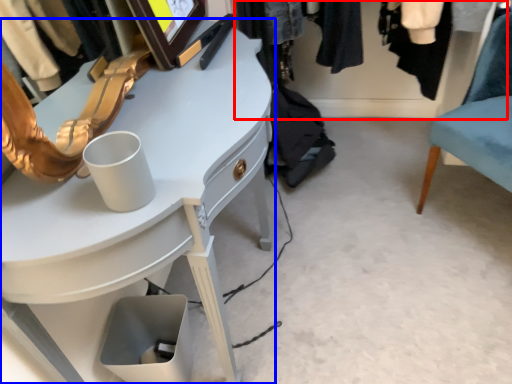
Question: Which point is closer to the camera, closet (highlighted by a red box) or desk (highlighted by a blue box)?

Choices:
 (A) closet
 (B) desk

Answer: (B)